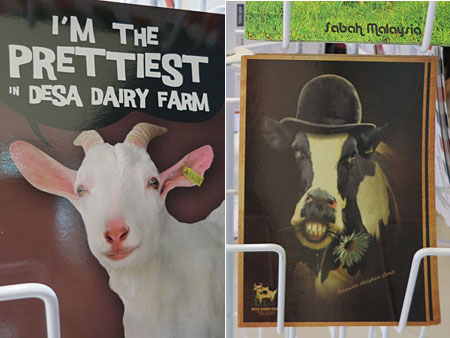
You are a GUI agent. You are given a task and a screenshot of the screen. Output one action in this format:
    pyautogui.click(x=<x>, y=<y>)
    Task: Click on the gold frame
    The width and height of the screenshot is (450, 338).
    Given the screenshot: What is the action you would take?
    pyautogui.click(x=429, y=158), pyautogui.click(x=241, y=155)